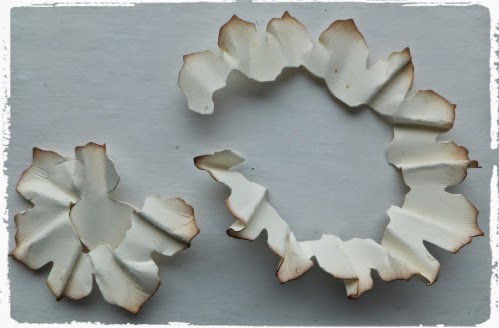
This screenshot has height=328, width=499. Find the location of `rounded corners`. rounded corners is located at coordinates (485, 6), (13, 7), (12, 317), (480, 321).